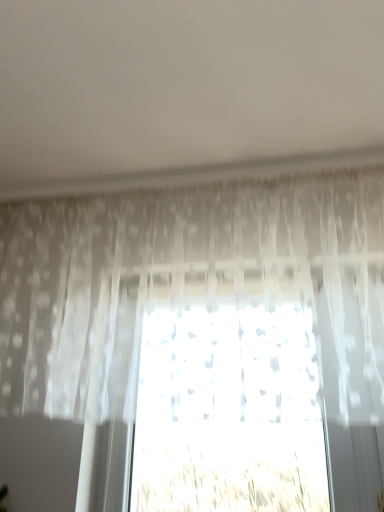
Question: Is translucent fabric plant at center inside the boundaries of translucent white curtain at center, or outside?

Choices:
 (A) inside
 (B) outside

Answer: (B)

Question: In terms of height, does translucent fabric plant at center look taller or shorter compared to translucent white curtain at center?

Choices:
 (A) short
 (B) tall

Answer: (A)

Question: Does point (226, 453) appear closer or farther from the camera than point (292, 200)?

Choices:
 (A) closer
 (B) farther

Answer: (A)

Question: From their relative heights in the image, would you say translucent white curtain at center is taller or shorter than translucent fabric plant at center?

Choices:
 (A) tall
 (B) short

Answer: (A)

Question: Is translucent white curtain at center spatially inside translucent fabric plant at center, or outside of it?

Choices:
 (A) outside
 (B) inside

Answer: (A)

Question: Considering the positions of point (48, 352) and point (158, 480), is point (48, 352) closer or farther from the camera than point (158, 480)?

Choices:
 (A) closer
 (B) farther

Answer: (A)

Question: Is translucent white curtain at center to the left or to the right of translucent fabric plant at center in the image?

Choices:
 (A) left
 (B) right

Answer: (A)